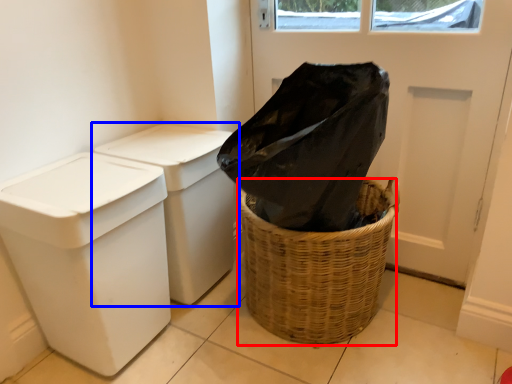
Question: Among these objects, which one is nearest to the camera, basket container (highlighted by a red box) or waste container (highlighted by a blue box)?

Choices:
 (A) basket container
 (B) waste container

Answer: (A)